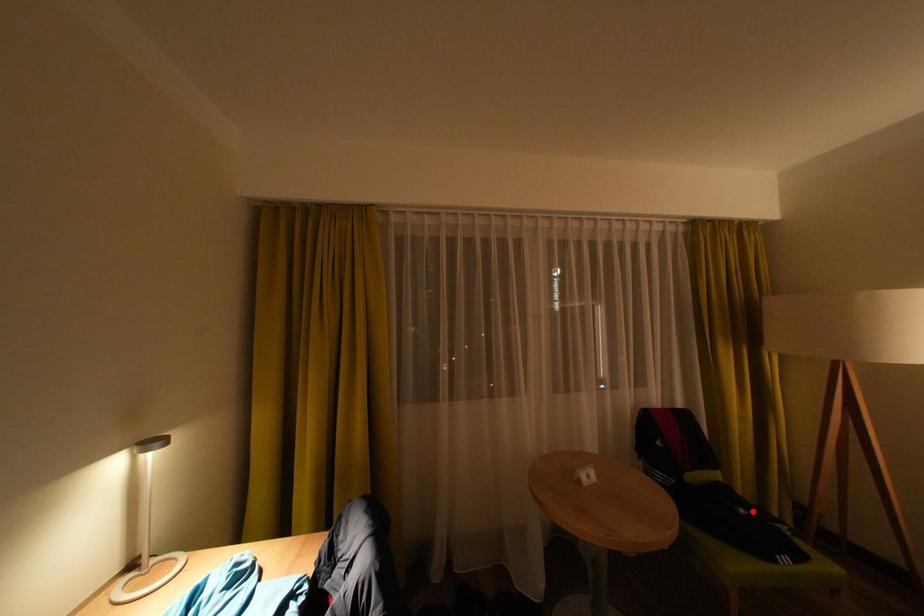
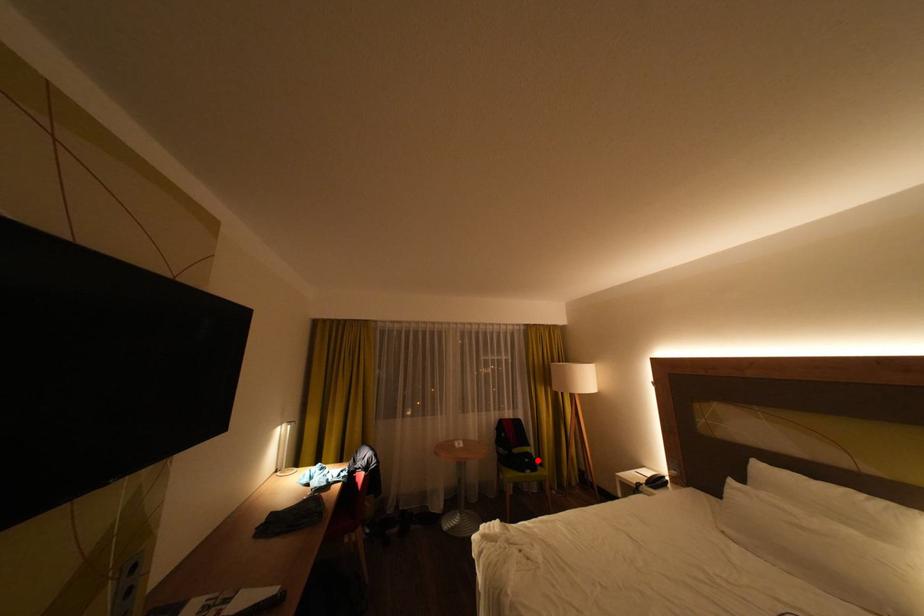
I am providing you with two images of the same scene from different viewpoints. A red point is marked on the first image and another point is marked on the second image. Is the marked point in image1 the same physical position as the marked point in image2?

Yes